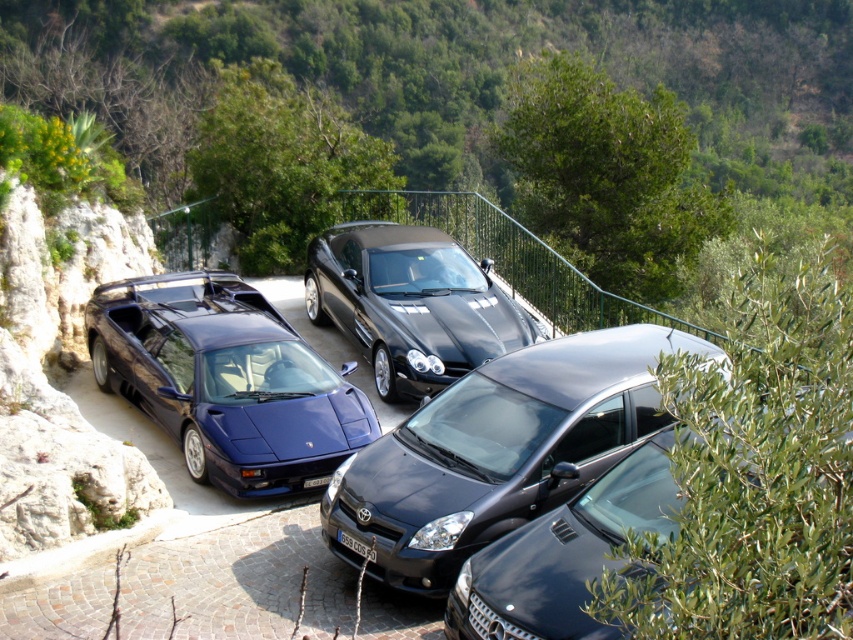
Question: Which point is closer to the camera?

Choices:
 (A) metallic blue sports car at left
 (B) glossy black sedan at center
 (C) glossy black car at center
 (D) satin black hatchback at center

Answer: (C)

Question: Observing the image, what is the correct spatial positioning of satin black hatchback at center in reference to metallic blue sports car at left?

Choices:
 (A) above
 (B) below

Answer: (B)

Question: Which object is farther from the camera taking this photo?

Choices:
 (A) satin black hatchback at center
 (B) glossy black sedan at center
 (C) glossy black car at center

Answer: (B)

Question: Does satin black hatchback at center appear on the right side of metallic blue sports car at left?

Choices:
 (A) no
 (B) yes

Answer: (B)

Question: Which object appears closest to the camera in this image?

Choices:
 (A) metallic blue sports car at left
 (B) glossy black car at center

Answer: (B)

Question: Is satin black hatchback at center in front of glossy black sedan at center?

Choices:
 (A) yes
 (B) no

Answer: (A)